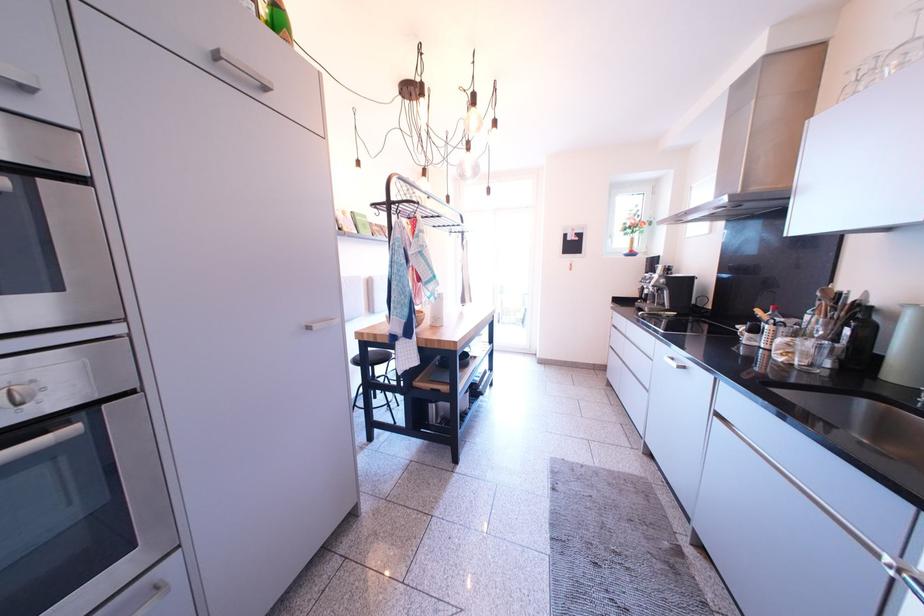
Identify the location of chair sitting surface. This screenshot has height=616, width=924. (373, 357).